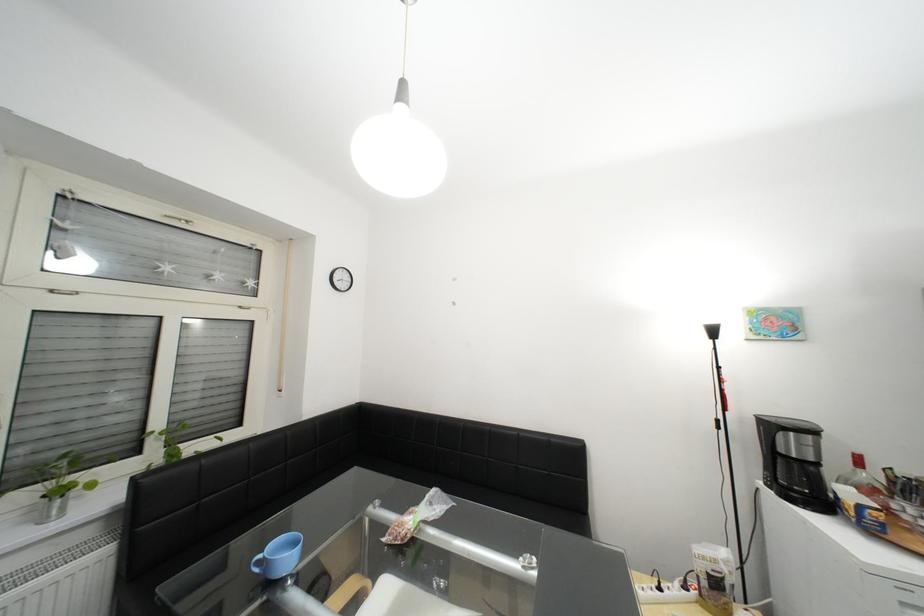
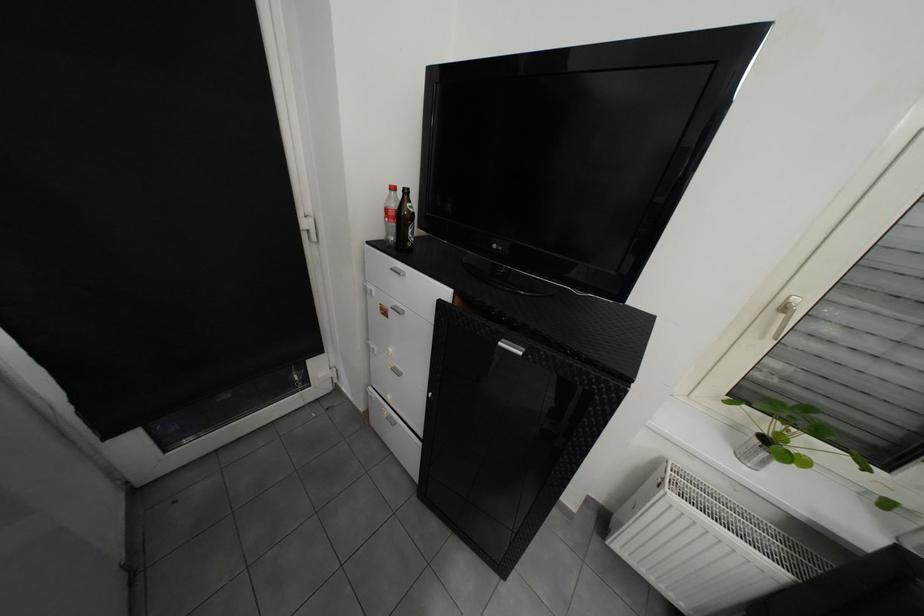
Find the pixel in the second image that matches pixel 55 522 in the first image.

(754, 458)